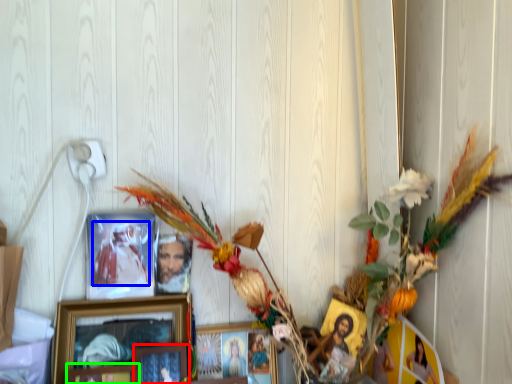
Question: Which object is positioned farthest from picture frame (highlighted by a red box)? Select from person (highlighted by a blue box) and picture frame (highlighted by a green box).

Choices:
 (A) person
 (B) picture frame

Answer: (A)